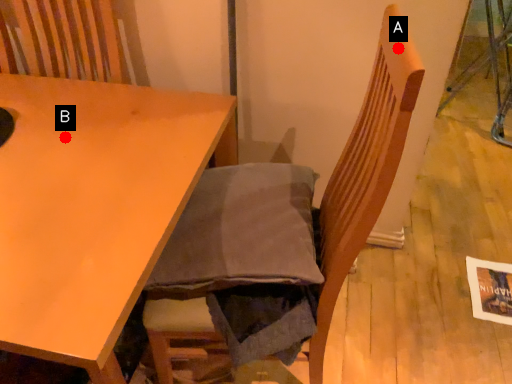
Question: Two points are circled on the image, labeled by A and B beside each circle. Which of the following is the closest to the observer?

Choices:
 (A) A is closer
 (B) B is closer

Answer: (A)